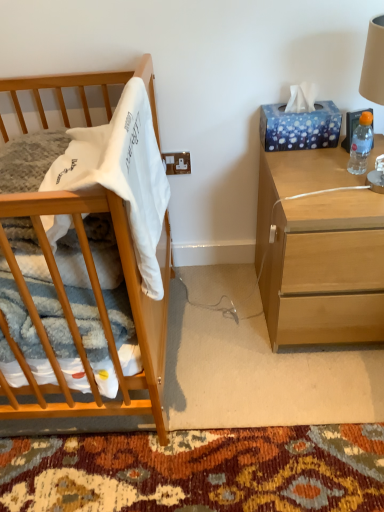
Locate an element on the screen. The image size is (384, 512). vacant space to the left of clear plastic bottle at right is located at coordinates (311, 179).